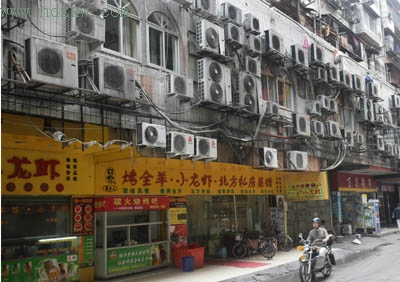
This screenshot has width=400, height=282. What are the coordinates of `fan` in the screenshot? It's located at (53, 72).